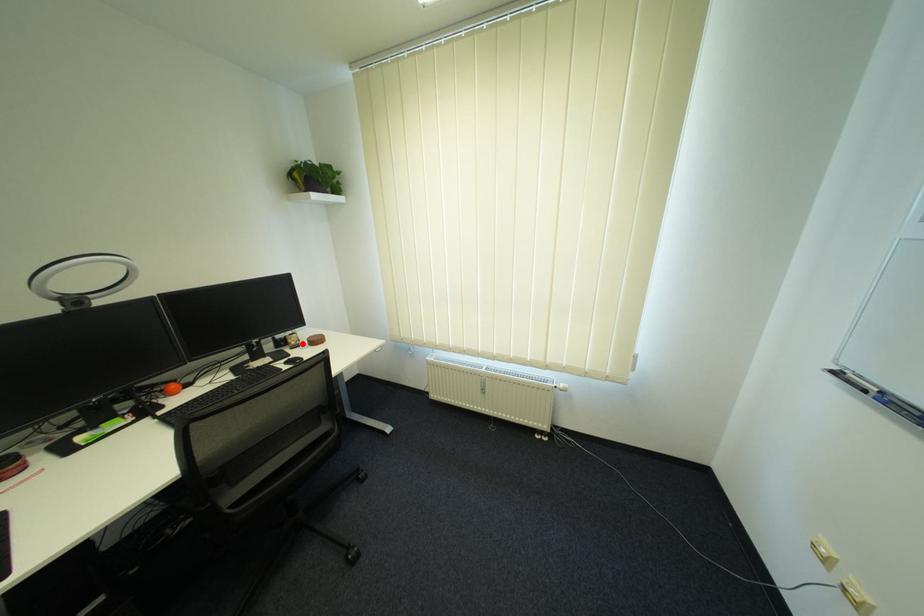
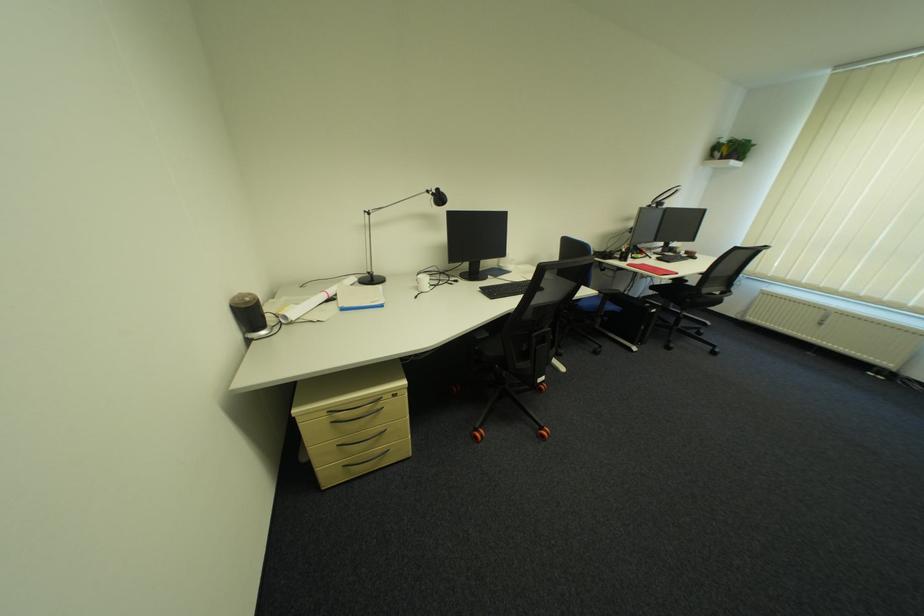
Question: I am providing you with two images of the same scene from different viewpoints. A red point is marked on the first image. Is the red point's position out of view in image 2?

Choices:
 (A) Yes
 (B) No

Answer: (B)